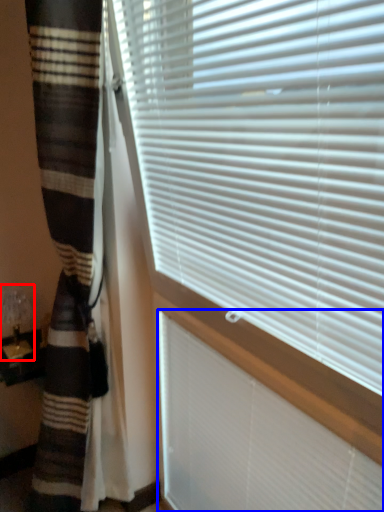
Question: Which point is closer to the camera, table lamp (highlighted by a red box) or blind (highlighted by a blue box)?

Choices:
 (A) table lamp
 (B) blind

Answer: (B)